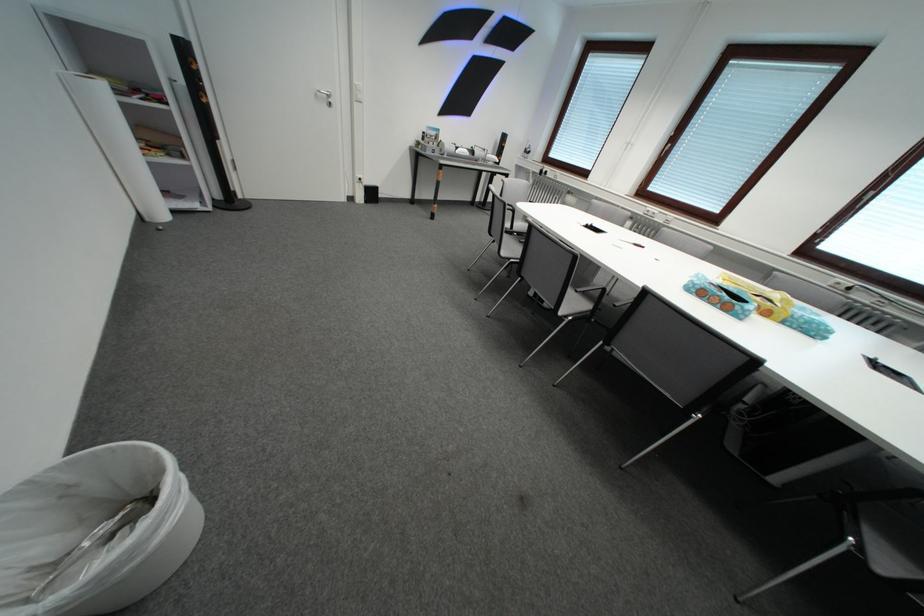
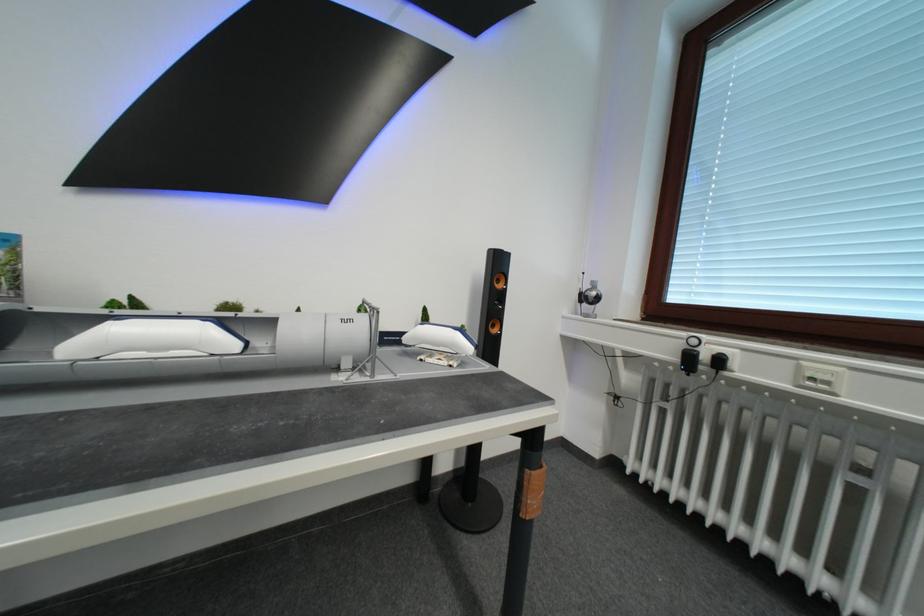
In the second image, find the point that corresponds to point 536,153 in the first image.

(592, 301)